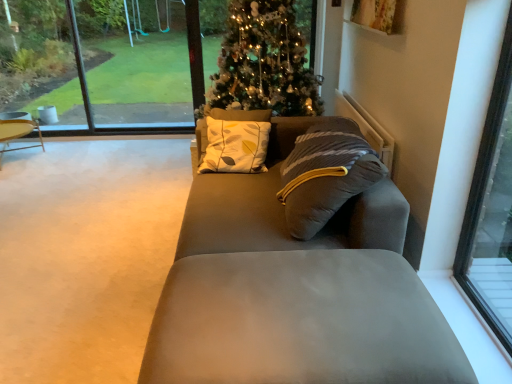
Locate an element on the screen. This screenshot has height=384, width=512. free space above suede-like gray footrest at lower center (from a real-world perspective) is located at coordinates (301, 293).